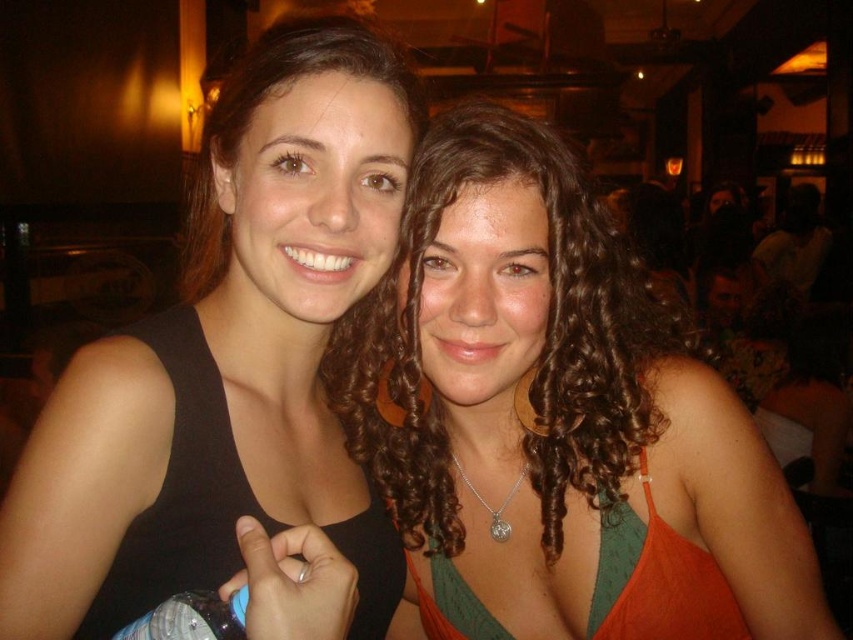
Question: Which of the following is the farthest from the observer?

Choices:
 (A) (554, 412)
 (B) (183, 484)

Answer: (A)

Question: Can you confirm if black matte tank top at left is wider than curly hair at center?

Choices:
 (A) yes
 (B) no

Answer: (B)

Question: Is the position of black matte tank top at left more distant than that of curly hair at center?

Choices:
 (A) no
 (B) yes

Answer: (A)

Question: Which point appears closest to the camera in this image?

Choices:
 (A) (524, 172)
 (B) (206, 252)

Answer: (A)

Question: Which point is farther from the camera taking this photo?

Choices:
 (A) (445, 173)
 (B) (277, 244)

Answer: (A)

Question: Is black matte tank top at left further to camera compared to curly hair at center?

Choices:
 (A) yes
 (B) no

Answer: (B)